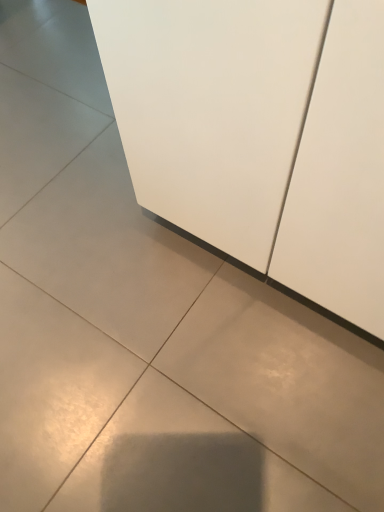
Find the location of a particular element. Image resolution: width=384 pixels, height=512 pixels. white glossy cabinet at upper center is located at coordinates (260, 134).

What do you see at coordinates (260, 134) in the screenshot? I see `white glossy cabinet at upper center` at bounding box center [260, 134].

In order to click on white glossy cabinet at upper center in this screenshot , I will do `click(260, 134)`.